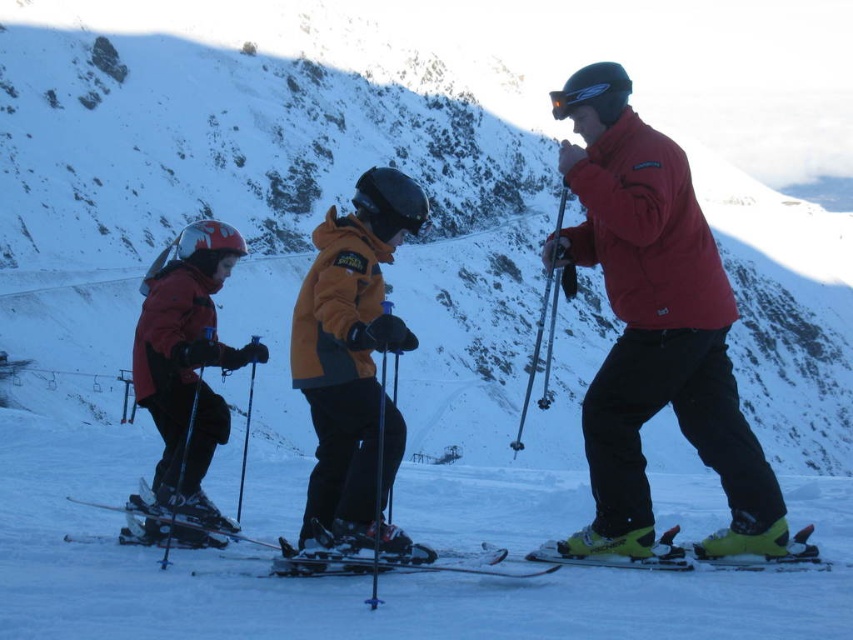
Question: Is matte red jacket at center smaller than orange fleece jacket at center?

Choices:
 (A) no
 (B) yes

Answer: (A)

Question: Among these objects, which one is nearest to the camera?

Choices:
 (A) matte black ski suit at left
 (B) matte red jacket at center
 (C) matte black skis at center

Answer: (B)

Question: Can you confirm if matte black ski suit at left is positioned to the right of yellow-green plastic ski at lower center?

Choices:
 (A) yes
 (B) no

Answer: (B)

Question: Is matte black ski suit at left to the left of shiny black ski at center from the viewer's perspective?

Choices:
 (A) no
 (B) yes

Answer: (B)

Question: Estimate the real-world distances between objects in this image. Which object is closer to the shiny black ski at center?

Choices:
 (A) matte black ski suit at left
 (B) yellow-green plastic ski at lower center
 (C) orange fleece jacket at center
 (D) matte red jacket at center

Answer: (C)

Question: Which of these objects is positioned closest to the matte black skis at center?

Choices:
 (A) shiny black ski at center
 (B) matte red jacket at center
 (C) orange fleece jacket at center
 (D) yellow-green plastic ski at lower center

Answer: (A)